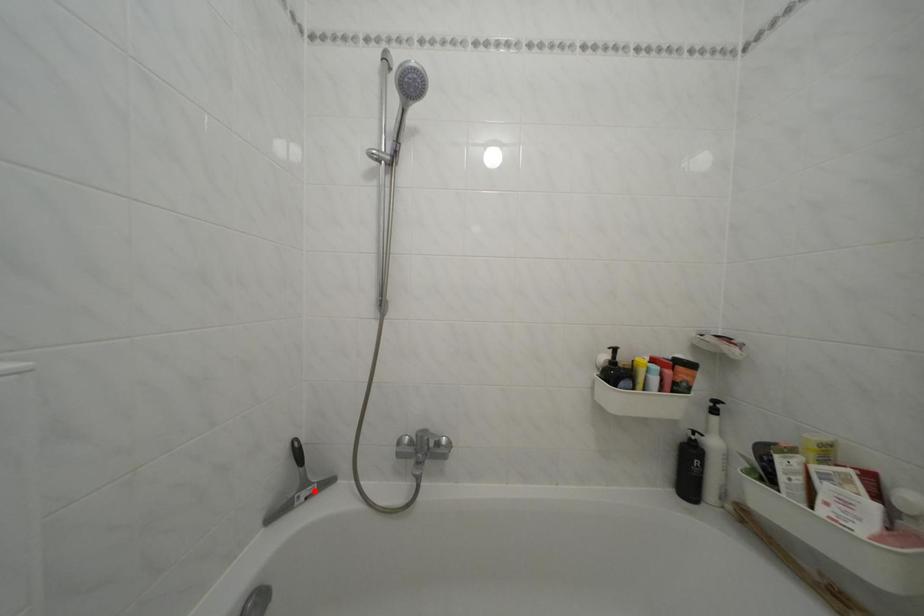
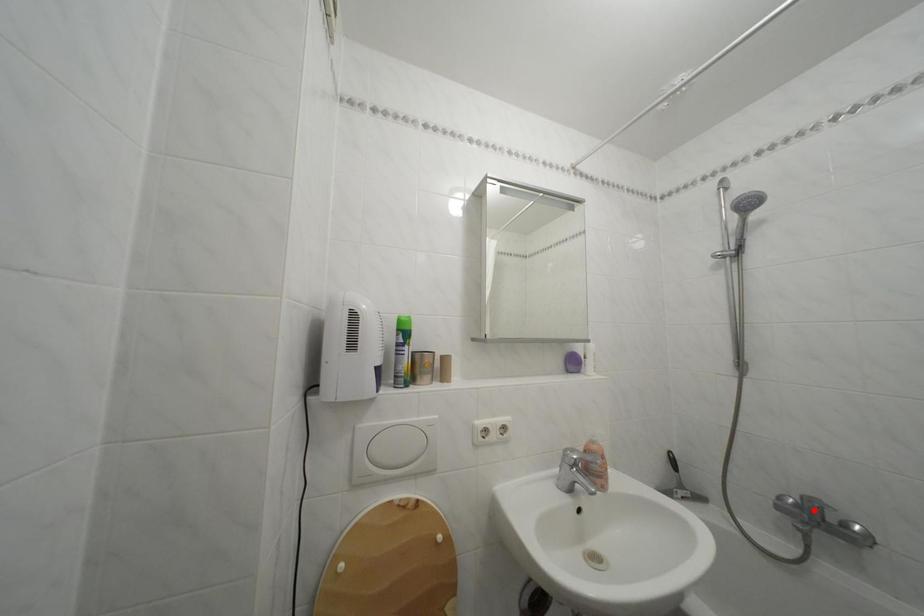
I am providing you with two images of the same scene from different viewpoints. A red point is marked on the first image and another point is marked on the second image. Is the marked point in image1 the same physical position as the marked point in image2?

No